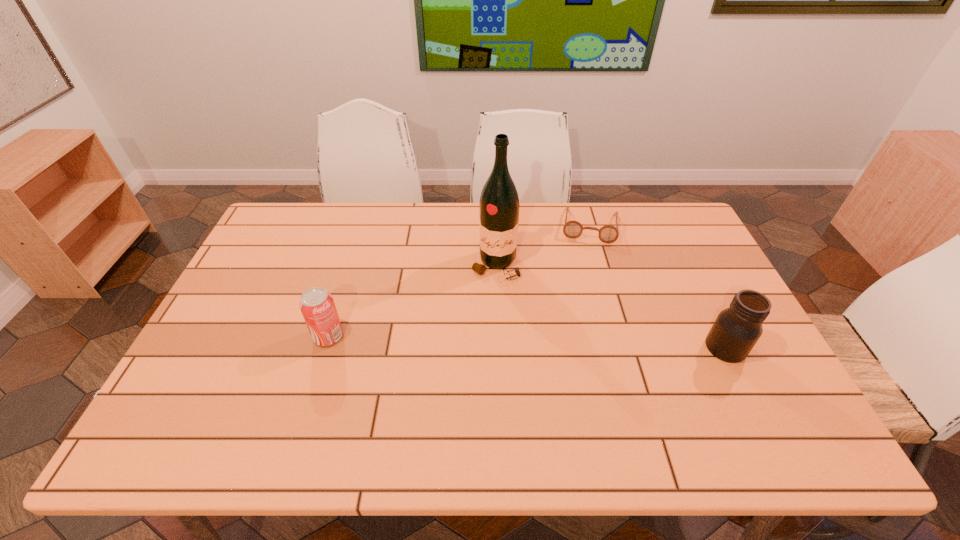
Where is `free space between the tallest object and the rightmost object`? free space between the tallest object and the rightmost object is located at coordinates (611, 306).

Identify the location of empty location between the shortest object and the wine bottle. (542, 246).

Identify the location of free space between the second object from right to left and the rightmost object. The width and height of the screenshot is (960, 540). (658, 287).

In order to click on free space between the jar and the spectacles in this screenshot , I will do `click(658, 287)`.

You are a GUI agent. You are given a task and a screenshot of the screen. Output one action in this format:
    pyautogui.click(x=<x>, y=<y>)
    Task: Click on the vacant space that's between the spectacles and the second farthest object
    The width and height of the screenshot is (960, 540).
    Given the screenshot: What is the action you would take?
    pyautogui.click(x=542, y=246)

At what (x,y) coordinates should I click in order to perform the action: click on object that can be found as the closest to the rightmost object. Please return your answer as a coordinate pair (x, y). The image size is (960, 540). Looking at the image, I should click on (572, 229).

The height and width of the screenshot is (540, 960). I want to click on object that stands as the closest to the rightmost object, so click(572, 229).

At what (x,y) coordinates should I click in order to perform the action: click on free location that satisfies the following two spatial constraints: 1. on the back side of the farthest object; 2. on the right side of the second farthest object. Please return your answer as a coordinate pair (x, y). Looking at the image, I should click on (494, 226).